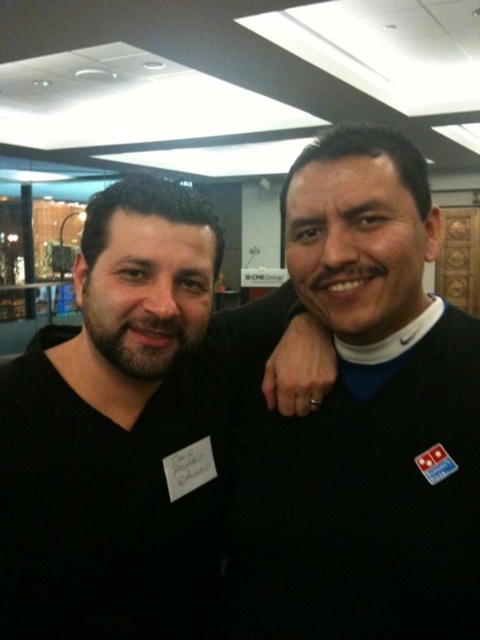
Is black sweater at right taller than black matte shirt at center?

Yes, black sweater at right is taller than black matte shirt at center.

Can you confirm if black sweater at right is positioned above black matte shirt at center?

Yes, black sweater at right is above black matte shirt at center.

Is point (313, 420) closer to viewer compared to point (327, 369)?

Yes, it is in front of point (327, 369).

This screenshot has height=640, width=480. In order to click on black sweater at right in this screenshot , I will do `click(363, 422)`.